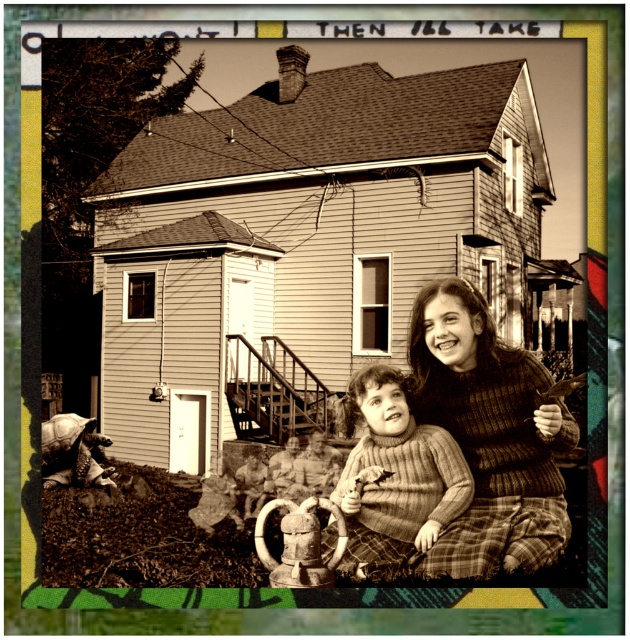
Question: Among these points, which one is nearest to the camera?

Choices:
 (A) (513, 426)
 (B) (348, 468)

Answer: (A)

Question: Can you confirm if knitted sweater at lower right is thinner than knitted sweater at center?

Choices:
 (A) no
 (B) yes

Answer: (A)

Question: Does knitted sweater at lower right appear over knitted sweater at center?

Choices:
 (A) yes
 (B) no

Answer: (A)

Question: Does knitted sweater at lower right lie in front of knitted sweater at center?

Choices:
 (A) yes
 (B) no

Answer: (A)